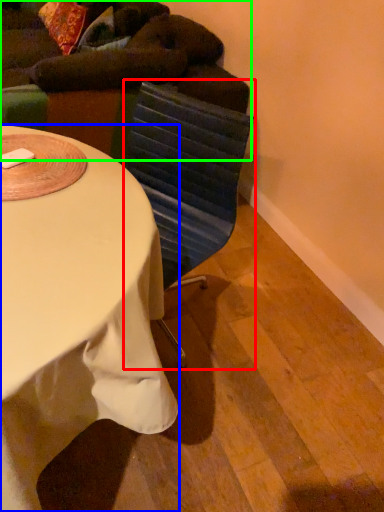
Question: Which is nearer to the swivel chair (highlighted by a red box)? desk (highlighted by a blue box) or bean bag chair (highlighted by a green box).

Choices:
 (A) desk
 (B) bean bag chair

Answer: (A)